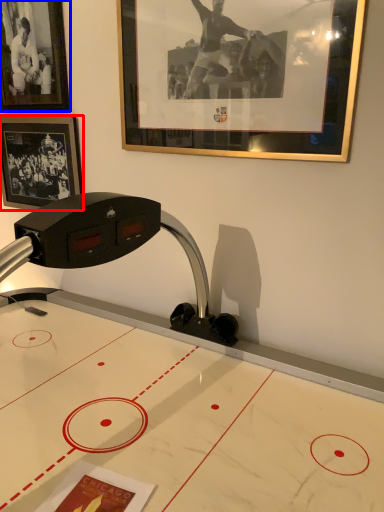
Question: Which point is closer to the camera, picture frame (highlighted by a red box) or picture frame (highlighted by a blue box)?

Choices:
 (A) picture frame
 (B) picture frame

Answer: (B)